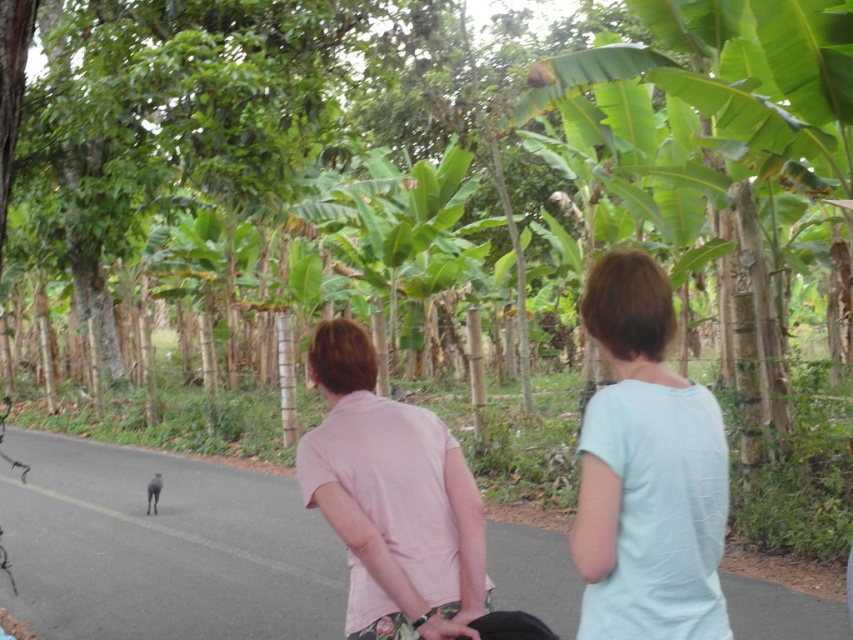
You are a photographer trying to capture both the light blue cotton shirt at center and the pink cotton shirt at center in the same frame. Considering their heights, which one should you position closer to the camera to ensure both are fully visible in the photo?

To ensure both the light blue cotton shirt at center and the pink cotton shirt at center are fully visible in the photo, position the shorter pink cotton shirt at center closer to the camera. Since the light blue cotton shirt at center is much taller, it will naturally appear in the background, allowing both subjects to fit within the frame.

You are a drone operator trying to capture a photo of the two people on the road. You have two points marked on your screen, point 1 at coordinates point (x=677, y=516) and point 2 at coordinates point (x=410, y=532). Which point should you focus on to ensure the person closer to the camera is in the foreground?

Point (x=677, y=516) is closer to the camera than point (x=410, y=532), so focusing on point (x=677, y=516) will ensure the person closer to the camera is in the foreground.

You are standing at the point labeled point (x=624, y=276) and want to walk to the point labeled point (x=474, y=634). Given the scene described, will you have to walk towards the two people or away from them?

Since point (x=624, y=276) is in front of point (x=474, y=634), you would have to walk away from the two people to reach point (x=474, y=634).